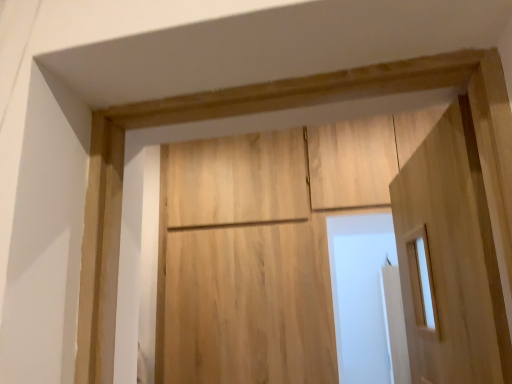
Question: Does natural wood barn door at center have a lesser height compared to light wood door at right?

Choices:
 (A) yes
 (B) no

Answer: (B)

Question: From a real-world perspective, is natural wood barn door at center positioned over light wood door at right based on gravity?

Choices:
 (A) yes
 (B) no

Answer: (A)

Question: Considering the relative positions of natural wood barn door at center and light wood door at right in the image provided, is natural wood barn door at center to the right of light wood door at right from the viewer's perspective?

Choices:
 (A) yes
 (B) no

Answer: (B)

Question: Would you say light wood door at right is part of natural wood barn door at center's contents?

Choices:
 (A) no
 (B) yes

Answer: (A)

Question: Considering the relative sizes of natural wood barn door at center and light wood door at right in the image provided, is natural wood barn door at center taller than light wood door at right?

Choices:
 (A) no
 (B) yes

Answer: (B)

Question: Is natural wood barn door at center at the left side of light wood door at right?

Choices:
 (A) no
 (B) yes

Answer: (B)

Question: Could you tell me if light wood door at right is facing natural wood barn door at center?

Choices:
 (A) yes
 (B) no

Answer: (B)

Question: Does light wood door at right lie in front of natural wood barn door at center?

Choices:
 (A) no
 (B) yes

Answer: (B)

Question: Is light wood door at right at the left side of natural wood barn door at center?

Choices:
 (A) no
 (B) yes

Answer: (A)

Question: Does light wood door at right appear on the right side of natural wood barn door at center?

Choices:
 (A) no
 (B) yes

Answer: (B)

Question: From a real-world perspective, is light wood door at right positioned under natural wood barn door at center based on gravity?

Choices:
 (A) yes
 (B) no

Answer: (A)

Question: Are light wood door at right and natural wood barn door at center located far from each other?

Choices:
 (A) yes
 (B) no

Answer: (A)

Question: From a real-world perspective, is natural wood barn door at center physically located above or below light wood door at right?

Choices:
 (A) above
 (B) below

Answer: (A)